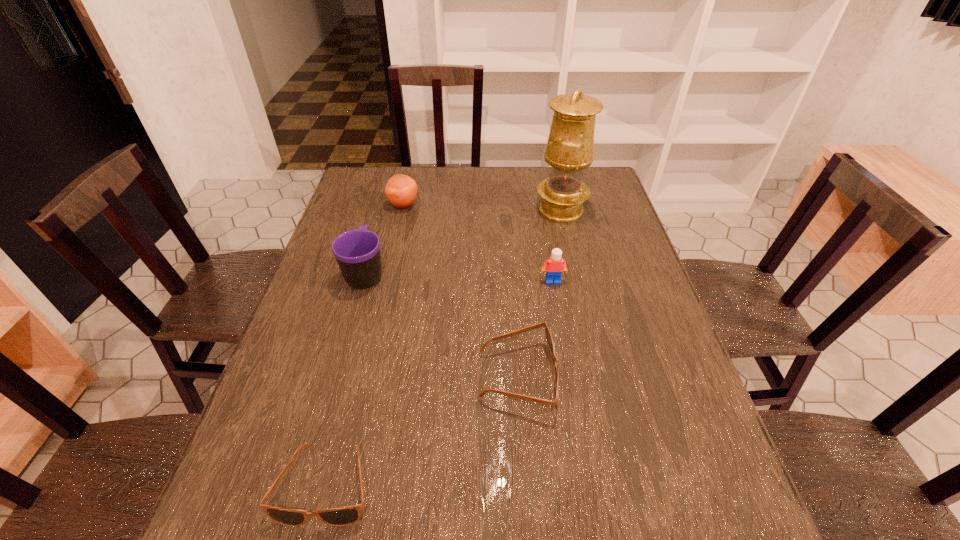
Find the location of a particular element. The height and width of the screenshot is (540, 960). free space located 0.100m with the handle on the side of the mug is located at coordinates (377, 233).

At what (x,y) coordinates should I click in order to perform the action: click on free spot located 0.110m with the handle on the side of the mug. Please return your answer as a coordinate pair (x, y). The height and width of the screenshot is (540, 960). Looking at the image, I should click on (377, 231).

This screenshot has height=540, width=960. What are the coordinates of `blank area located with the handle on the side of the mug` in the screenshot? It's located at (391, 182).

Locate an element on the screen. This screenshot has height=540, width=960. free space located 0.060m on the left of the oil lamp is located at coordinates (517, 210).

This screenshot has width=960, height=540. In order to click on vacant space positioned 0.240m on the face of the Lego in this screenshot , I will do `click(565, 356)`.

The width and height of the screenshot is (960, 540). I want to click on orange situated at the far edge, so click(x=401, y=190).

You are a GUI agent. You are given a task and a screenshot of the screen. Output one action in this format:
    pyautogui.click(x=<x>, y=<y>)
    Task: Click on the oil lamp that is at the far edge
    
    Given the screenshot: What is the action you would take?
    pyautogui.click(x=569, y=151)

At what (x,y) coordinates should I click in order to perform the action: click on object that is positioned at the near edge. Please return your answer as a coordinate pair (x, y). This screenshot has width=960, height=540. Looking at the image, I should click on (343, 516).

Find the location of a particular element. sunglasses that is positioned at the left edge is located at coordinates coord(343,516).

This screenshot has height=540, width=960. Find the location of `orange that is positioned at the left edge`. orange that is positioned at the left edge is located at coordinates (401, 190).